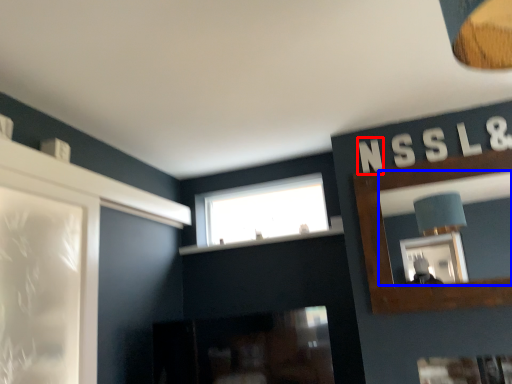
Question: Which point is further to the camera, letter (highlighted by a red box) or mirror (highlighted by a blue box)?

Choices:
 (A) letter
 (B) mirror

Answer: (A)